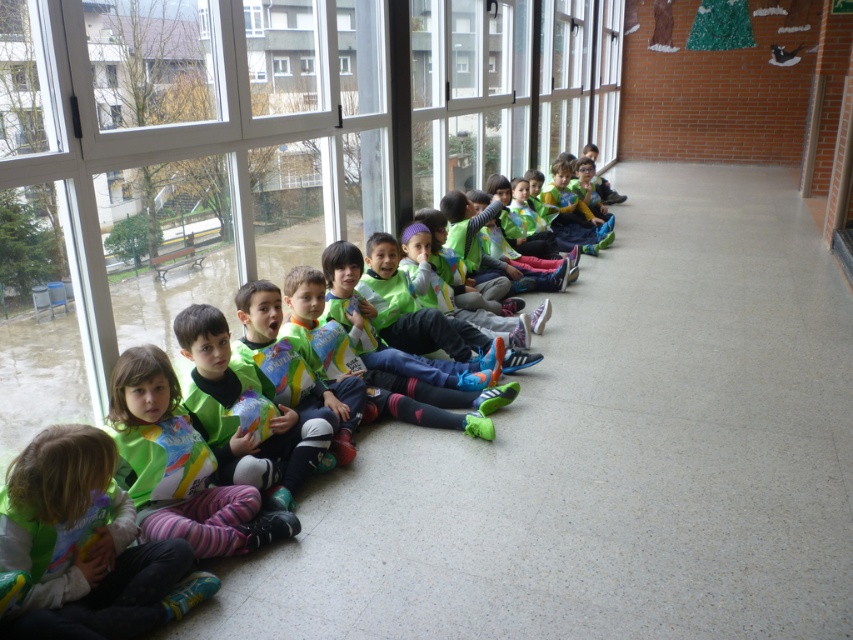
Question: Does matte green jacket at lower left appear on the right side of transparent glass window at upper center?

Choices:
 (A) yes
 (B) no

Answer: (B)

Question: Which point is closer to the camera taking this photo?

Choices:
 (A) (79, 528)
 (B) (181, 500)
 (C) (282, 58)

Answer: (A)

Question: Which point appears closest to the camera in this image?

Choices:
 (A) (288, 58)
 (B) (119, 356)

Answer: (B)

Question: Is green matte vest at center to the left of transparent glass window at upper center from the viewer's perspective?

Choices:
 (A) yes
 (B) no

Answer: (A)

Question: Which object is closer to the camera taking this photo?

Choices:
 (A) transparent glass window at upper center
 (B) matte green jacket at lower left
 (C) green matte vest at center

Answer: (B)

Question: Does matte green jacket at lower left appear over transparent glass window at upper center?

Choices:
 (A) no
 (B) yes

Answer: (A)